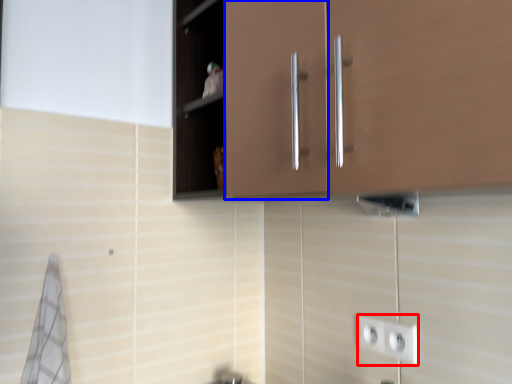
Question: Which object is further to the camera taking this photo, socket (highlighted by a red box) or cabinetry (highlighted by a blue box)?

Choices:
 (A) socket
 (B) cabinetry

Answer: (B)